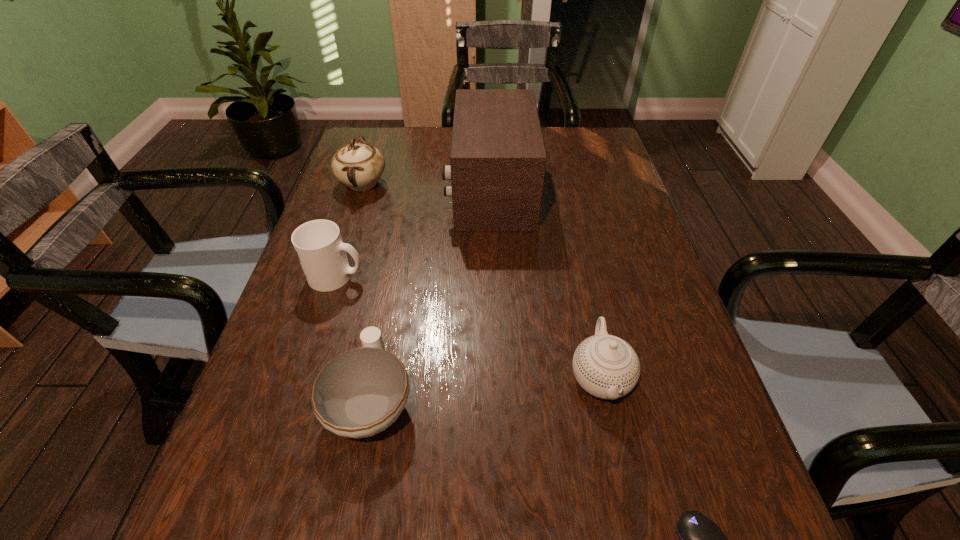
This screenshot has height=540, width=960. Find the location of `vacant space in between the second shortest object and the mug`. vacant space in between the second shortest object and the mug is located at coordinates (354, 338).

The width and height of the screenshot is (960, 540). In order to click on object identified as the fifth closest to the fifth tallest object in this screenshot , I will do `click(359, 166)`.

Select which object appears as the second closest to the rightmost chinaware. Please provide its 2D coordinates. Your answer should be formatted as a tuple, i.e. [(x, y)], where the tuple contains the x and y coordinates of a point satisfying the conditions above.

[(361, 392)]

The width and height of the screenshot is (960, 540). In order to click on chinaware identified as the second closest to the third farthest object in this screenshot , I will do `click(359, 166)`.

Select which chinaware appears as the closest to the shortest object. Please provide its 2D coordinates. Your answer should be formatted as a tuple, i.e. [(x, y)], where the tuple contains the x and y coordinates of a point satisfying the conditions above.

[(605, 366)]

Find the location of a particular element. This screenshot has width=960, height=540. blank area in the image that satisfies the following two spatial constraints: 1. on the side with the handle of the second shortest object; 2. on the handle side of the fourth nearest object is located at coordinates point(395,276).

Identify the location of free space that satisfies the following two spatial constraints: 1. on the handle side of the mug; 2. on the side with the handle of the shortest chinaware. pyautogui.click(x=299, y=400).

Find the location of a particular element. The height and width of the screenshot is (540, 960). free space in the image that satisfies the following two spatial constraints: 1. on the handle side of the mug; 2. on the side with the handle of the shortest chinaware is located at coordinates (299, 400).